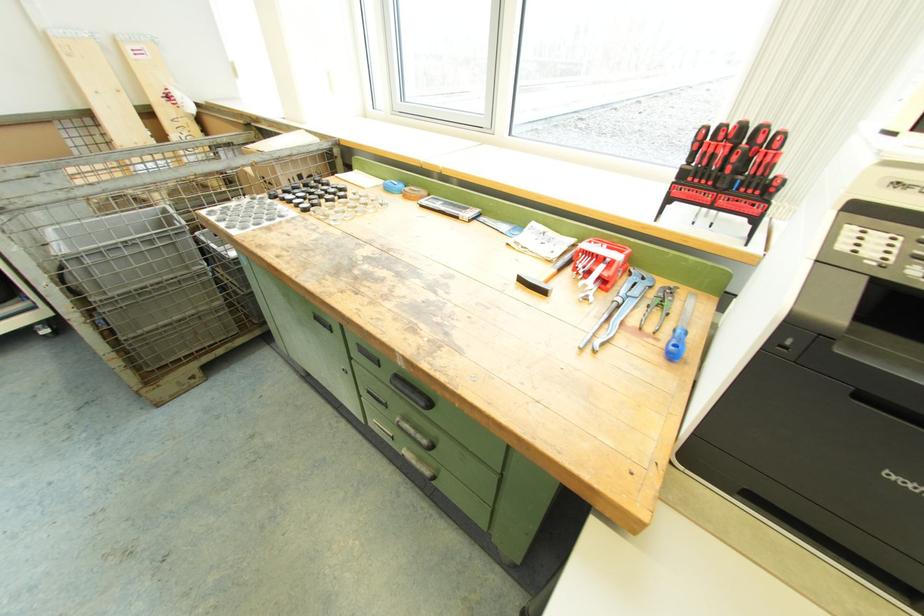
Which object does [625,309] point to?

It refers to a metal wrench.